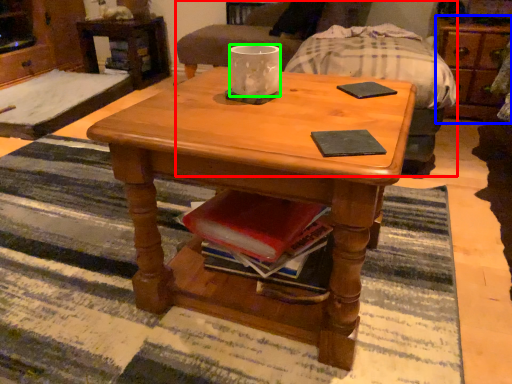
Question: Which is nearer to the armchair (highlighted by a red box)? dresser (highlighted by a blue box) or coffee cup (highlighted by a green box).

Choices:
 (A) dresser
 (B) coffee cup

Answer: (A)